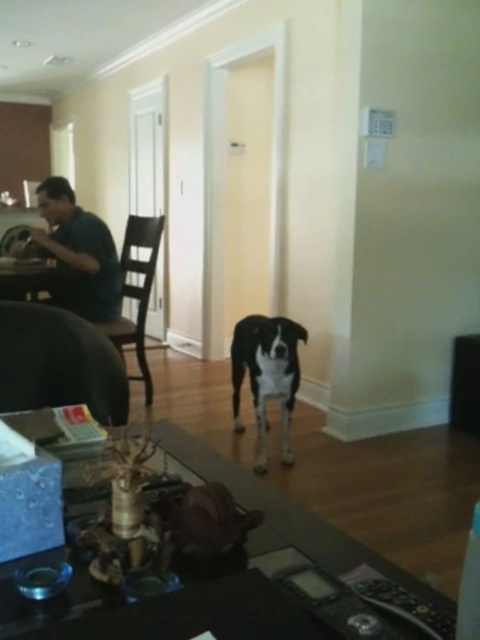
Question: Does black glass table at center have a lesser width compared to dark blue shirt at left?

Choices:
 (A) yes
 (B) no

Answer: (B)

Question: Which of the following is the farthest from the observer?

Choices:
 (A) brown wooden chair at left
 (B) black leather armchair at left

Answer: (A)

Question: Considering the real-world distances, which object is closest to the dark blue shirt at left?

Choices:
 (A) black matte dog at center
 (B) black leather armchair at left
 (C) brown wooden chair at left

Answer: (C)

Question: Can you confirm if black matte dog at center is bigger than brown wooden chair at left?

Choices:
 (A) yes
 (B) no

Answer: (B)

Question: Does black leather armchair at left have a smaller size compared to brown wooden chair at left?

Choices:
 (A) yes
 (B) no

Answer: (A)

Question: Which of the following is the closest to the observer?

Choices:
 (A) (285, 371)
 (B) (104, 358)

Answer: (B)